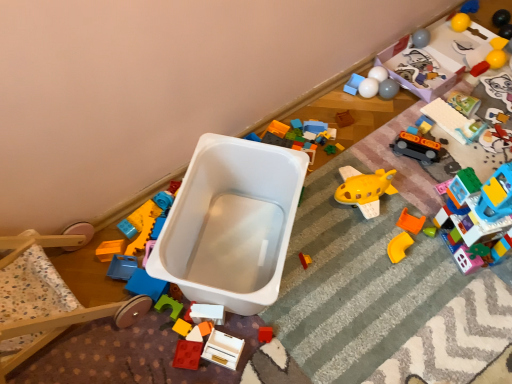
The height and width of the screenshot is (384, 512). Find the location of `vacant space that is in between orange matte plastic corner piece at lower right, the eighth toy positioned from the left, and white plastic baby carriage at center`. vacant space that is in between orange matte plastic corner piece at lower right, the eighth toy positioned from the left, and white plastic baby carriage at center is located at coordinates (331, 263).